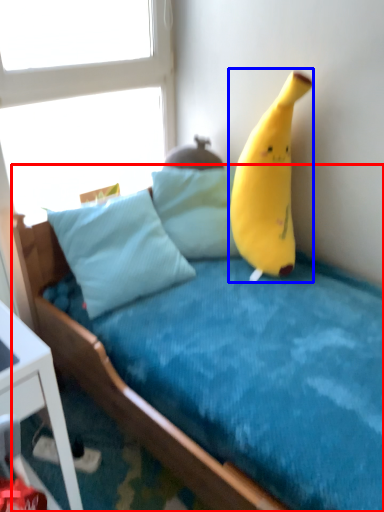
Question: Which object appears closest to the camera in this image, bed (highlighted by a red box) or banana (highlighted by a blue box)?

Choices:
 (A) bed
 (B) banana

Answer: (A)